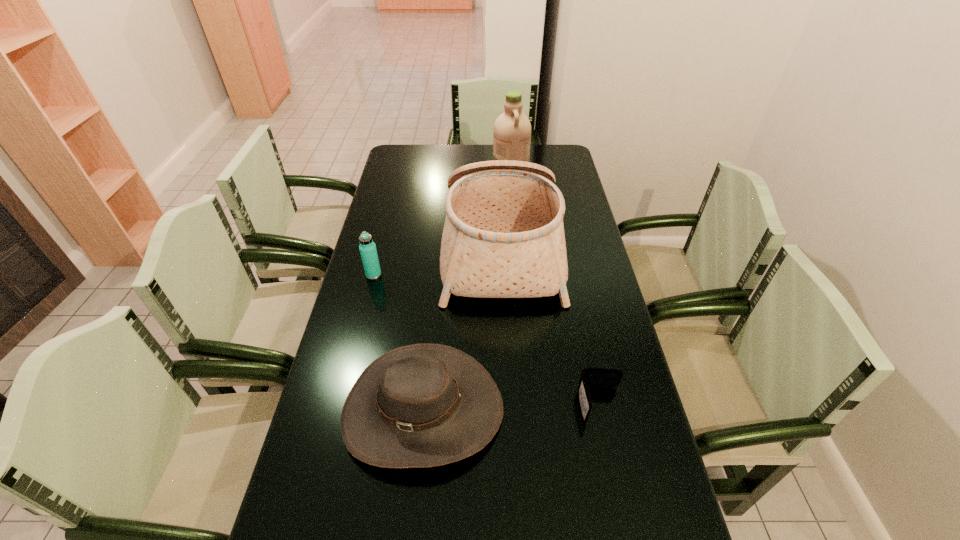
Where is `vacant area at the right edge of the desktop`? The image size is (960, 540). vacant area at the right edge of the desktop is located at coordinates (608, 303).

Identify the location of vacant space in between the basket and the water bottle. This screenshot has height=540, width=960. (438, 262).

Where is `free point between the cowboy hat and the basket`? The image size is (960, 540). free point between the cowboy hat and the basket is located at coordinates (462, 330).

The height and width of the screenshot is (540, 960). What are the coordinates of `unoccupied position between the basket and the water bottle` in the screenshot? It's located at (438, 262).

Find the location of a particular element. The width and height of the screenshot is (960, 540). free area in between the cleansing agent and the water bottle is located at coordinates (443, 218).

Where is `free space between the water bottle and the shortest object`? This screenshot has height=540, width=960. free space between the water bottle and the shortest object is located at coordinates (487, 339).

Locate an element on the screen. vacant space that is in between the basket and the shortest object is located at coordinates (551, 327).

Locate an element on the screen. This screenshot has height=540, width=960. vacant space in between the water bottle and the farthest object is located at coordinates (443, 218).

Locate which object is the second closest to the farthest object. Please provide its 2D coordinates. Your answer should be formatted as a tuple, i.e. [(x, y)], where the tuple contains the x and y coordinates of a point satisfying the conditions above.

[(367, 247)]

Locate which object ranks in proximity to the wallet. Please provide its 2D coordinates. Your answer should be formatted as a tuple, i.e. [(x, y)], where the tuple contains the x and y coordinates of a point satisfying the conditions above.

[(424, 405)]